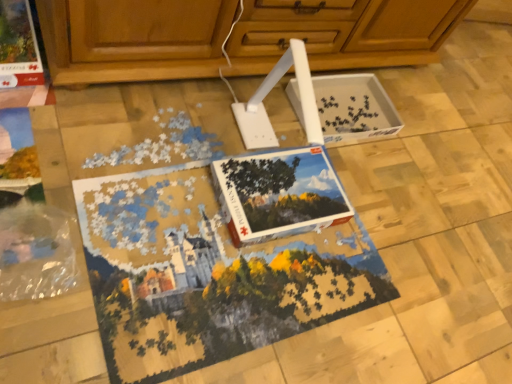
Question: Is matte cardboard magazine at upper left, the 2th magazine ordered from the bottom, further to camera compared to white cardboard puzzle box at center, the 1th magazine from the right?

Choices:
 (A) yes
 (B) no

Answer: (A)

Question: Are matte cardboard magazine at upper left, the 1th magazine from the left, and white cardboard puzzle box at center, the 1th magazine from the right, making contact?

Choices:
 (A) yes
 (B) no

Answer: (B)

Question: Considering the relative sizes of matte cardboard magazine at upper left, which appears as the 1th magazine when viewed from the top, and white cardboard puzzle box at center, which is the first magazine in bottom-to-top order, in the image provided, is matte cardboard magazine at upper left, which appears as the 1th magazine when viewed from the top, shorter than white cardboard puzzle box at center, which is the first magazine in bottom-to-top order,?

Choices:
 (A) no
 (B) yes

Answer: (A)

Question: Can you confirm if matte cardboard magazine at upper left, the 2th magazine ordered from the bottom, is smaller than white cardboard puzzle box at center, which is the first magazine in bottom-to-top order?

Choices:
 (A) yes
 (B) no

Answer: (A)

Question: Does matte cardboard magazine at upper left, the 2th magazine ordered from the bottom, contain white cardboard puzzle box at center, which is the 2th magazine from left to right?

Choices:
 (A) no
 (B) yes

Answer: (A)

Question: Is white cardboard puzzle box at center, which is the 2th magazine from left to right, wider or thinner than wooden cabinet at upper center?

Choices:
 (A) thin
 (B) wide

Answer: (A)

Question: From a real-world perspective, is white cardboard puzzle box at center, the 1th magazine from the right, physically located above or below wooden cabinet at upper center?

Choices:
 (A) below
 (B) above

Answer: (A)

Question: From the image's perspective, is white cardboard puzzle box at center, which is the 2th magazine from left to right, positioned above or below wooden cabinet at upper center?

Choices:
 (A) above
 (B) below

Answer: (B)

Question: Considering their positions, is white cardboard puzzle box at center, which is the 2th magazine from left to right, located in front of or behind wooden cabinet at upper center?

Choices:
 (A) behind
 (B) front

Answer: (A)

Question: Does point (2, 11) appear closer or farther from the camera than point (314, 198)?

Choices:
 (A) farther
 (B) closer

Answer: (B)

Question: In the image, is matte cardboard magazine at upper left, the 2th magazine ordered from the bottom, positioned in front of or behind white cardboard puzzle box at center, which is the first magazine in bottom-to-top order?

Choices:
 (A) front
 (B) behind

Answer: (B)

Question: In terms of size, does matte cardboard magazine at upper left, the 1th magazine from the left, appear bigger or smaller than white cardboard puzzle box at center, which is the first magazine in bottom-to-top order?

Choices:
 (A) big
 (B) small

Answer: (B)

Question: From a real-world perspective, is matte cardboard magazine at upper left, which is the second magazine from right to left, physically located above or below white cardboard puzzle box at center, the 2th magazine from the top?

Choices:
 (A) above
 (B) below

Answer: (A)

Question: Considering the positions of wooden cabinet at upper center and white cardboard puzzle box at center, which is the 2th magazine from left to right, in the image, is wooden cabinet at upper center wider or thinner than white cardboard puzzle box at center, which is the 2th magazine from left to right,?

Choices:
 (A) wide
 (B) thin

Answer: (A)

Question: Does point (148, 18) appear closer or farther from the camera than point (315, 213)?

Choices:
 (A) farther
 (B) closer

Answer: (B)